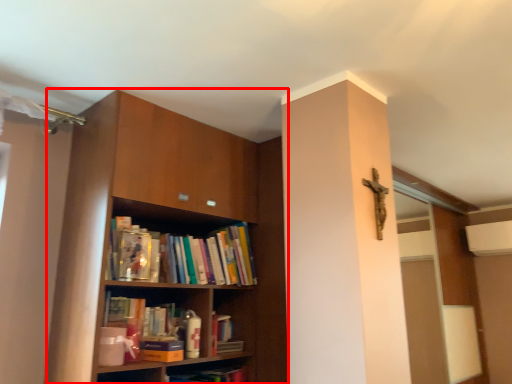
Question: From the image's perspective, where is shelf (annotated by the red box) located in relation to paperback book in the image?

Choices:
 (A) below
 (B) above

Answer: (B)